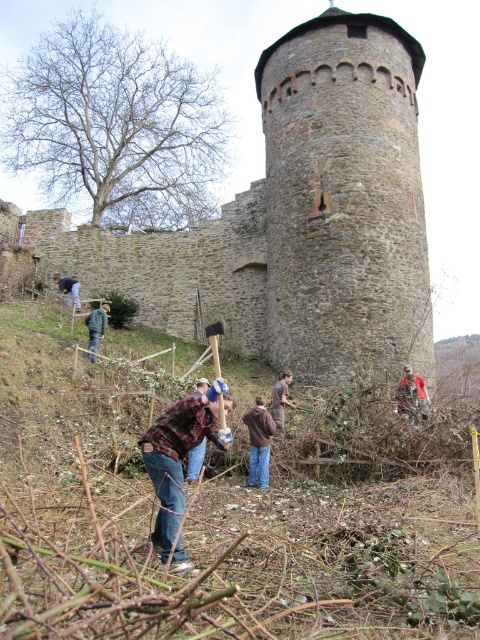
Can you confirm if dark gray stone tower at center is positioned above gray stone tower at center?

Correct, dark gray stone tower at center is located above gray stone tower at center.

Image resolution: width=480 pixels, height=640 pixels. I want to click on dark gray stone tower at center, so click(x=297, y=218).

Is flannel shirt at center shorter than plaid flannel shirt at center?

Incorrect, flannel shirt at center's height does not fall short of plaid flannel shirt at center's.

Who is taller, flannel shirt at center or plaid flannel shirt at center?

flannel shirt at center

Who is more distant from viewer, [172,458] or [191,464]?

Point [191,464]

What are the coordinates of `flannel shirt at center` in the screenshot? It's located at (179, 454).

Which is behind, point (103, 305) or point (405, 368)?

Point (103, 305)

Find the location of a particular element. This screenshot has width=480, height=640. green denim jacket at lower left is located at coordinates (96, 326).